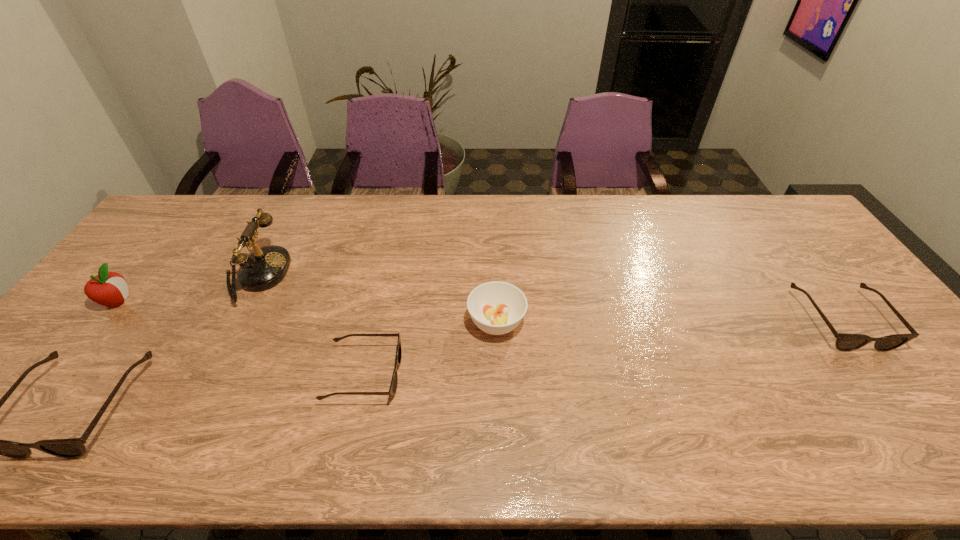
Identify the location of vacant space located on the back of the fifth shortest object. (183, 216).

Locate an element on the screen. vacant space located 0.130m on the dial of the telephone is located at coordinates (330, 275).

Image resolution: width=960 pixels, height=540 pixels. In order to click on free spot located on the right of the soup bowl in this screenshot , I will do `click(647, 322)`.

This screenshot has width=960, height=540. I want to click on object that is at the near edge, so click(x=393, y=386).

This screenshot has height=540, width=960. Identify the location of object present at the left edge. (107, 288).

Where is `object that is at the right edge`? Image resolution: width=960 pixels, height=540 pixels. object that is at the right edge is located at coordinates (844, 342).

Identify the location of vacant area at the far edge. (281, 237).

In the image, there is a desktop. Find the location of `vacant region at the near edge`. vacant region at the near edge is located at coordinates (665, 410).

In the image, there is a desktop. Where is `free space at the left edge`? The image size is (960, 540). free space at the left edge is located at coordinates (75, 336).

Locate an element on the screen. Image resolution: width=960 pixels, height=540 pixels. free space at the right edge is located at coordinates (860, 330).